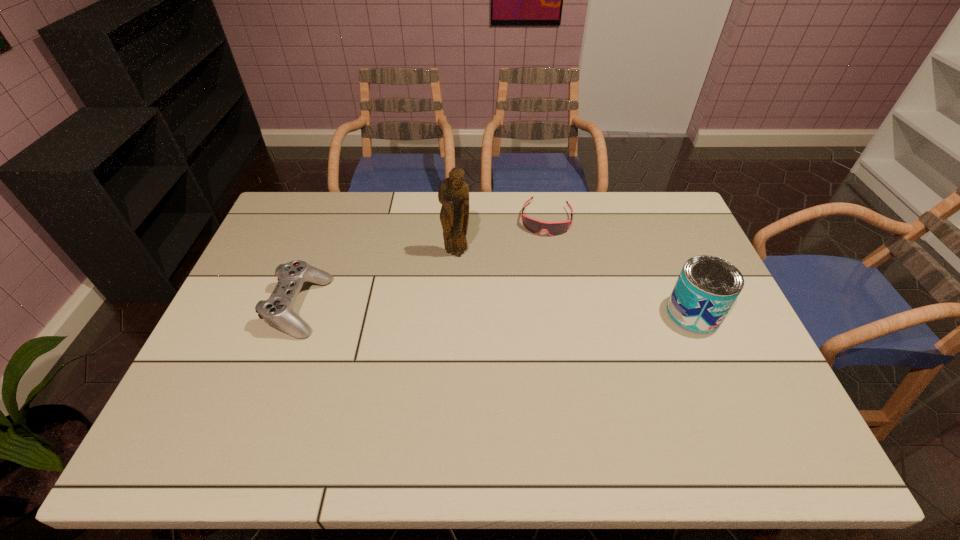
You are a GUI agent. You are given a task and a screenshot of the screen. Output one action in this format:
    pyautogui.click(x=<x>, y=<y>)
    Task: Click on the vacant space on the desktop that is between the second shortest object and the rightmost object and is positioned on the front-facing side of the goggles
    
    Given the screenshot: What is the action you would take?
    pyautogui.click(x=530, y=310)

In order to click on free spot on the desktop that is between the leftmost object and the can and is positioned on the front-facing side of the third nearest object in this screenshot , I will do `click(443, 309)`.